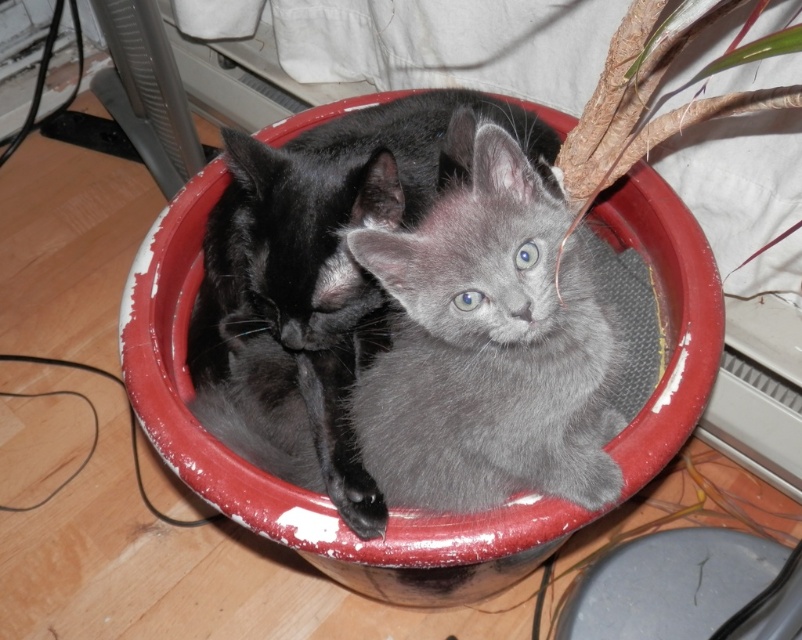
You are a cat owner who wants to place a new smooth plastic lid at lower right near the gray fluffy cat at center. Based on the current arrangement, where should you position the lid relative to the cat?

The gray fluffy cat at center is positioned on the left side of the smooth plastic lid at lower right, so you should place the lid to the right of the gray fluffy cat at center.

You are a small toy mouse. You want to roll from the gray fluffy cat at center to the smooth plastic lid at lower right. Can you make it in one roll without stopping?

The gray fluffy cat at center and smooth plastic lid at lower right are 24.82 inches apart from each other. Since the toy mouse can roll that distance, yes, it can make it in one roll without stopping.

You are a cat owner who wants to place a new toy between the soft gray kitten at center and the fibrous brown plant at upper right. Based on their positions, where should you place the toy to ensure it is between them?

The soft gray kitten at center is located below the fibrous brown plant at upper right, so placing the toy midway between them would position it between the two objects.